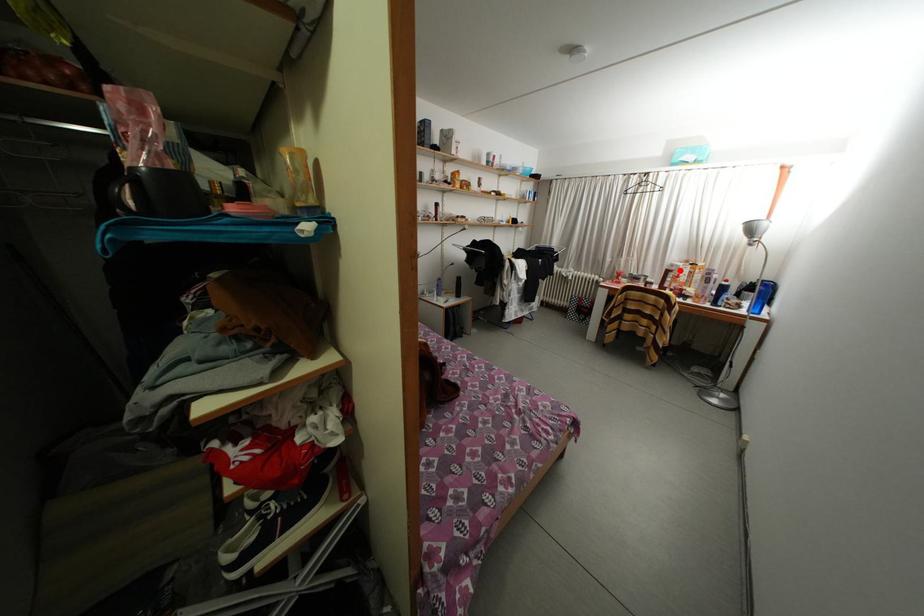
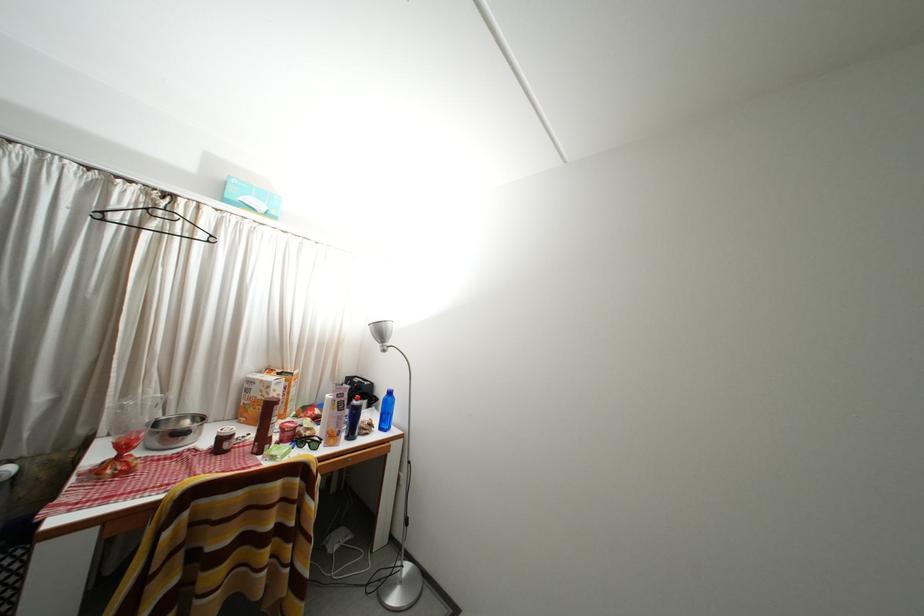
Question: I am providing you with two images of the same scene from different viewpoints. Given a red point in image1, look at the same physical point in image2. Is it:

Choices:
 (A) Closer to the viewpoint
 (B) Farther from the viewpoint

Answer: (B)